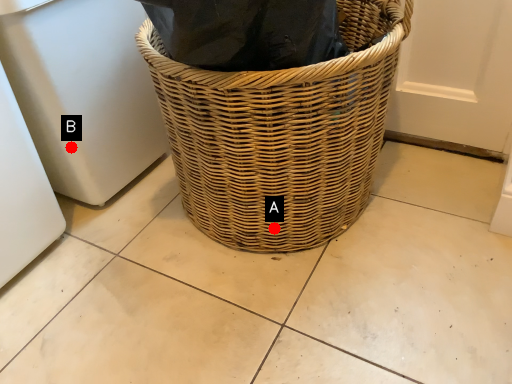
Question: Two points are circled on the image, labeled by A and B beside each circle. Which point is farther to the camera?

Choices:
 (A) A is further
 (B) B is further

Answer: (B)